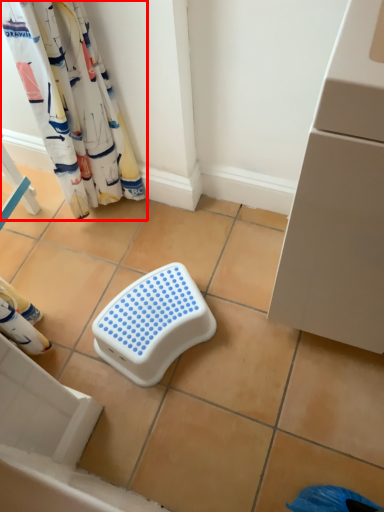
Question: Where is curtain (annotated by the red box) located in relation to step stool in the image?

Choices:
 (A) right
 (B) left

Answer: (B)